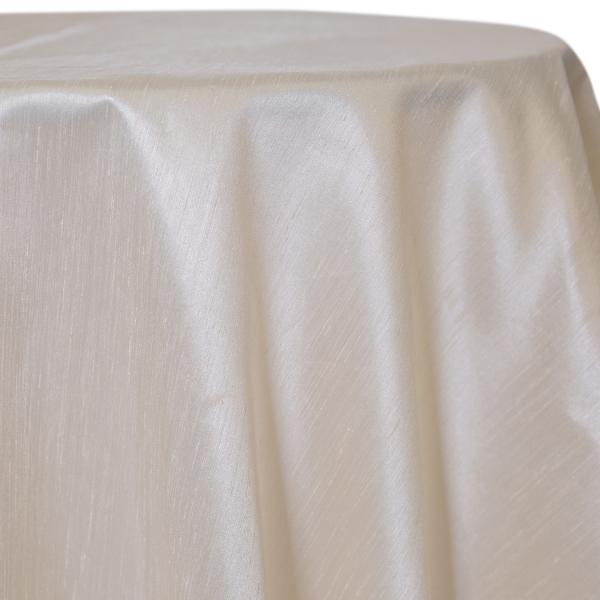
Identify the location of shadow of table top showing through cloth. (443, 97), (287, 110), (51, 117).